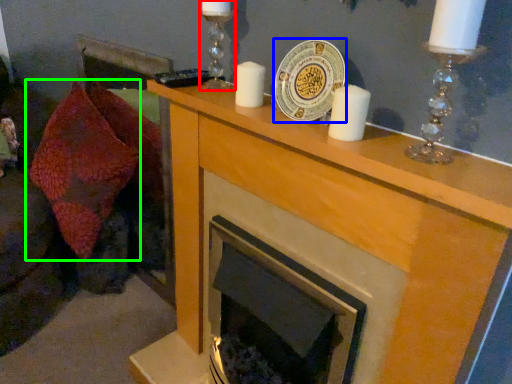
Question: Which is farther away from candle holder (highlighted by a red box)? platter (highlighted by a blue box) or throw pillow (highlighted by a green box)?

Choices:
 (A) platter
 (B) throw pillow

Answer: (B)